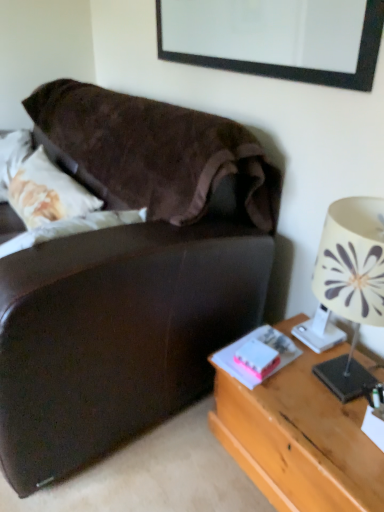
Find the location of a particular element. The image size is (384, 512). free location in front of white matte book at lower right, the 1th book viewed from the left is located at coordinates (296, 402).